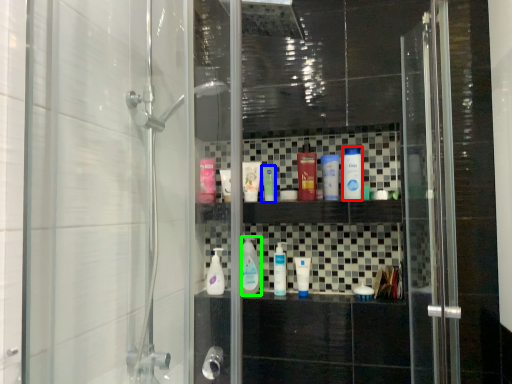
Question: Based on their relative distances, which object is farther from mouthwash (highlighted by a red box)? Choose from mouthwash (highlighted by a blue box) and mouthwash (highlighted by a green box).

Choices:
 (A) mouthwash
 (B) mouthwash

Answer: (B)